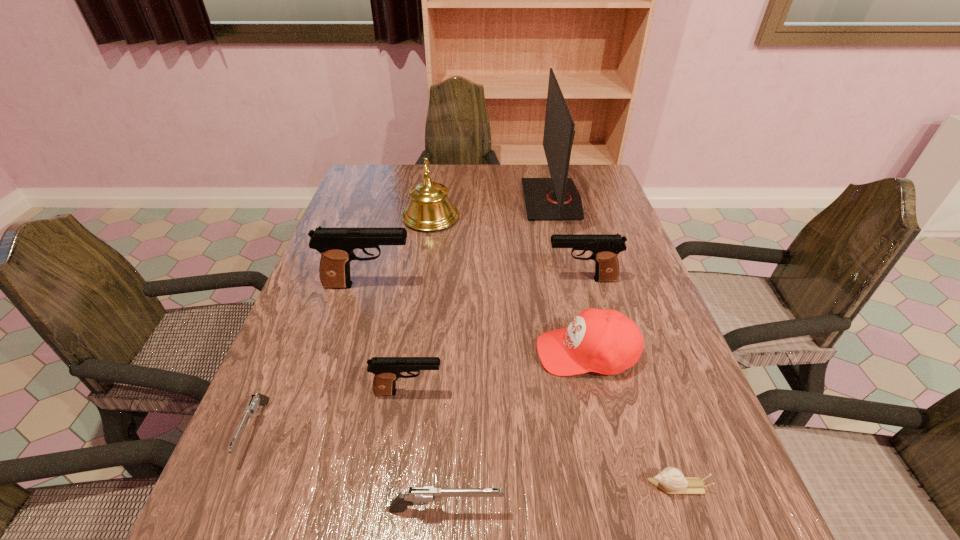
In the image, there is a desktop. At what (x,y) coordinates should I click in order to perform the action: click on free space at the right edge. Please return your answer as a coordinate pair (x, y). Looking at the image, I should click on (633, 388).

The image size is (960, 540). I want to click on vacant space at the near left corner of the desktop, so click(276, 535).

Where is `free space between the bell and the tallest pistol`? The width and height of the screenshot is (960, 540). free space between the bell and the tallest pistol is located at coordinates (399, 251).

Image resolution: width=960 pixels, height=540 pixels. I want to click on vacant point located between the fifth farthest object and the nearer silver pistol, so click(x=516, y=431).

Image resolution: width=960 pixels, height=540 pixels. In order to click on unoccupied position between the third farthest pistol and the nearest object in this screenshot , I will do `click(427, 451)`.

What are the coordinates of `free area in between the tallest object and the sixth farthest object` in the screenshot? It's located at (480, 296).

You are a GUI agent. You are given a task and a screenshot of the screen. Output one action in this format:
    pyautogui.click(x=<x>, y=<y>)
    Task: Click on the vacant area that lies between the baseball cap and the black monitor
    The width and height of the screenshot is (960, 540).
    Given the screenshot: What is the action you would take?
    pyautogui.click(x=569, y=276)

Find the location of a particular element. The width and height of the screenshot is (960, 540). free space between the nearer silver pistol and the eighth tallest object is located at coordinates (350, 470).

Find the location of a particular element. The height and width of the screenshot is (540, 960). free space between the bell and the smallest black pistol is located at coordinates (420, 305).

This screenshot has width=960, height=540. I want to click on vacant area that lies between the fifth farthest object and the second shortest pistol, so click(x=516, y=431).